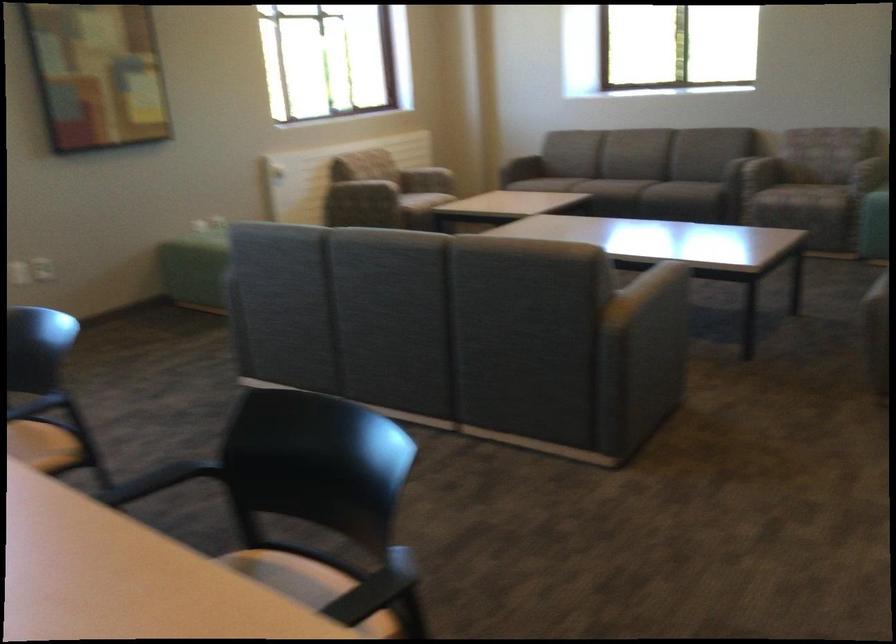
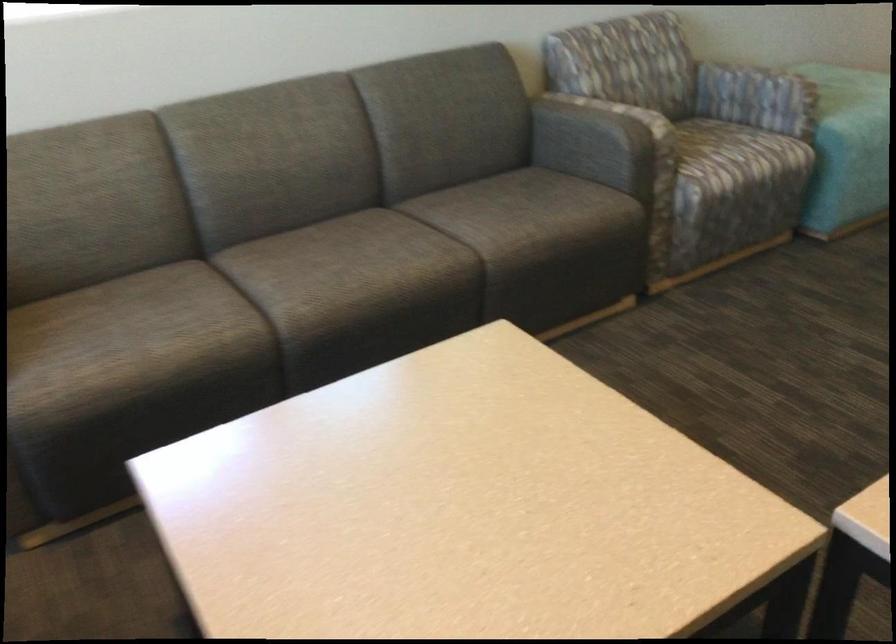
Question: I am providing you with two images of the same scene from different viewpoints. After the viewpoint changes to image2, which objects are now occluded?

Choices:
 (A) teal chair sitting surface
 (B) marker pen
 (C) patterned chair armrest
 (D) sofa armrest

Answer: (D)